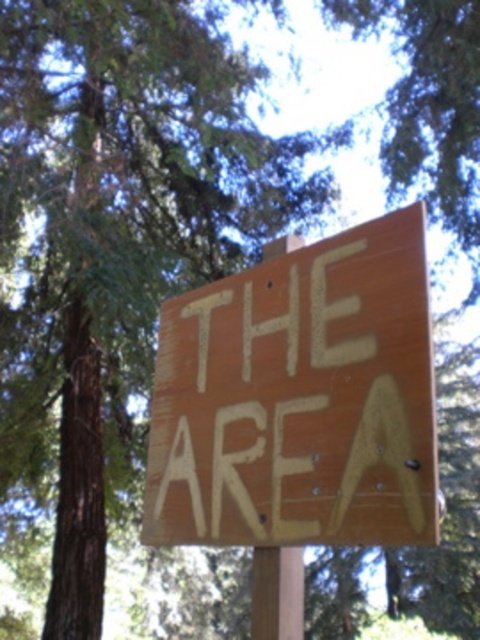
Question: Which object is closer to the camera taking this photo?

Choices:
 (A) brown wood pole at center
 (B) wooden sign at center

Answer: (B)

Question: Which point is closer to the camera?

Choices:
 (A) wooden sign at center
 (B) brown wood pole at center

Answer: (A)

Question: Can you confirm if wooden sign at center is thinner than brown wood pole at center?

Choices:
 (A) no
 (B) yes

Answer: (A)

Question: Does wooden sign at center appear over brown wood pole at center?

Choices:
 (A) no
 (B) yes

Answer: (B)

Question: Is wooden sign at center to the right of brown wood pole at center from the viewer's perspective?

Choices:
 (A) no
 (B) yes

Answer: (A)